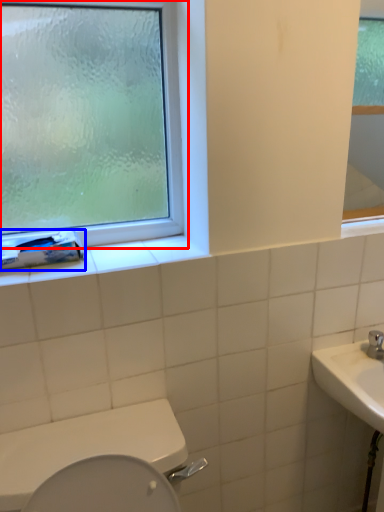
Question: Which of the following is the closest to the observer, window (highlighted by a red box) or toilet paper (highlighted by a blue box)?

Choices:
 (A) window
 (B) toilet paper

Answer: (A)